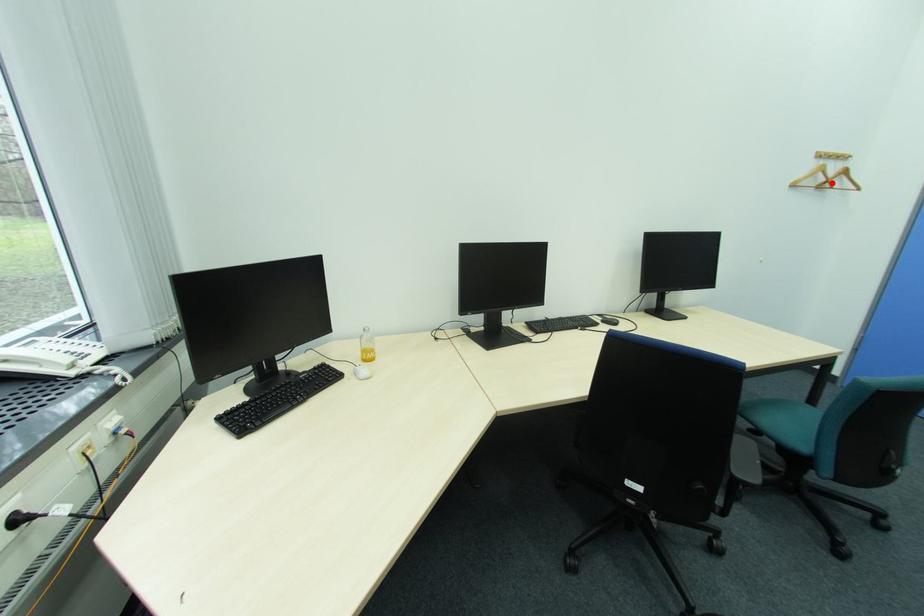
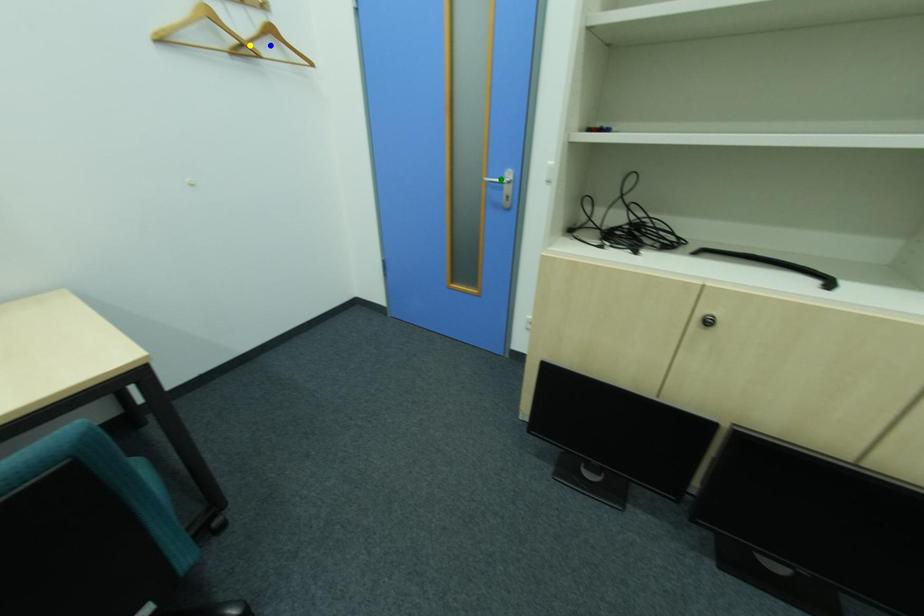
Question: I am providing you with two images of the same scene from different viewpoints. A red point is marked on the first image. You are given multiple points on the second image. Can you choose the point in image 2 that corresponds to the point in image 1?

Choices:
 (A) green point
 (B) yellow point
 (C) blue point

Answer: (B)